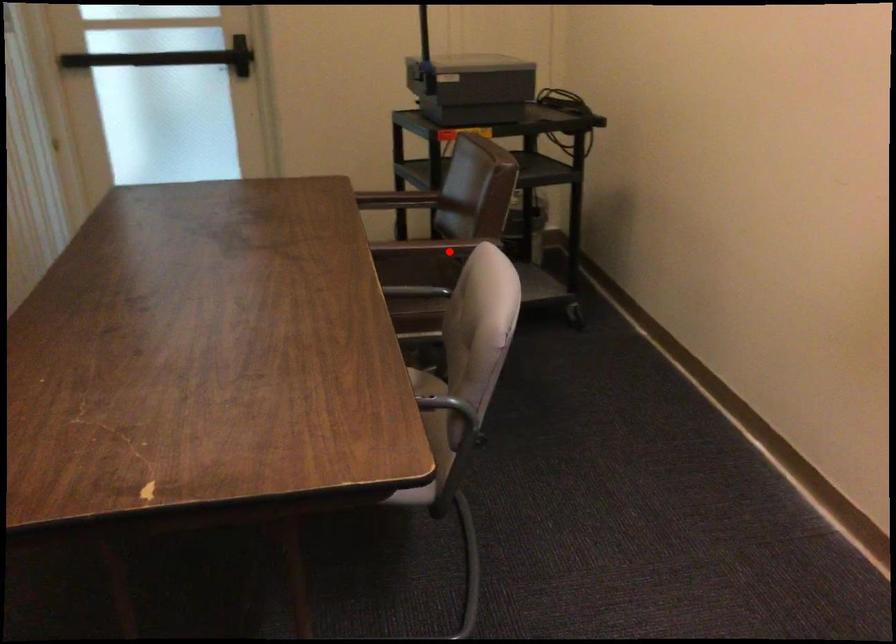
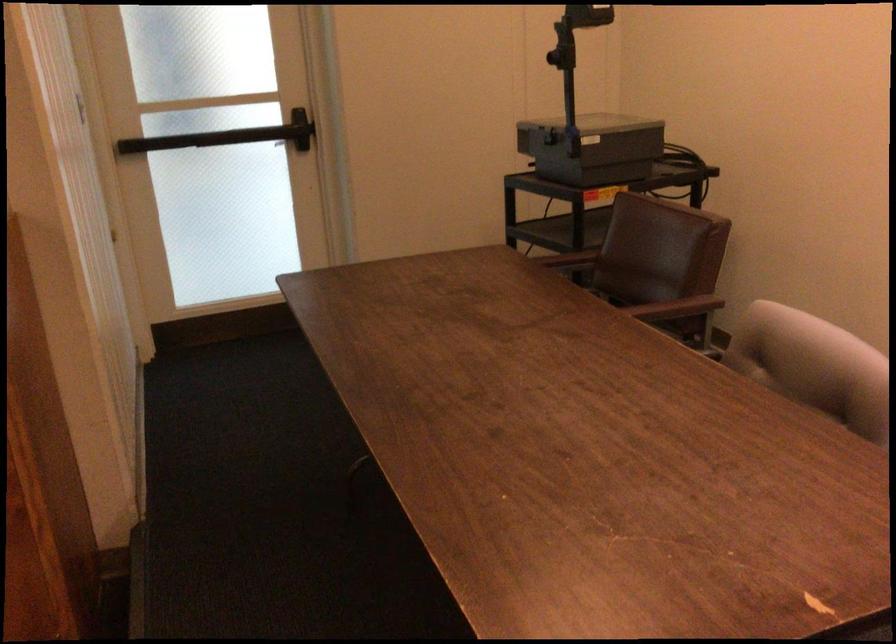
The point at the highlighted location is marked in the first image. Where is the corresponding point in the second image?

(677, 308)